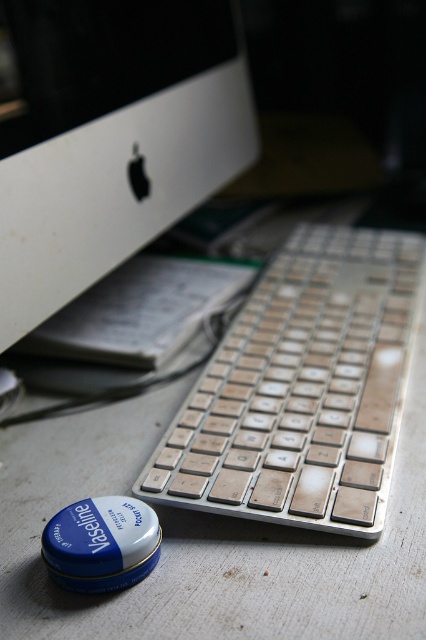
Is white matte computer monitor at upper left bigger than silver metallic keyboard at center?

Yes, white matte computer monitor at upper left is bigger than silver metallic keyboard at center.

Can you confirm if white matte computer monitor at upper left is positioned below silver metallic keyboard at center?

No.

Does point (42, 141) lie in front of point (198, 448)?

No, (42, 141) is further to viewer.

The image size is (426, 640). I want to click on white matte computer monitor at upper left, so click(114, 138).